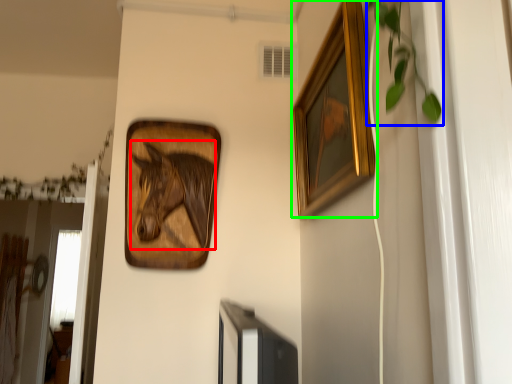
Question: Estimate the real-world distances between objects in this image. Which object is closer to animal (highlighted by a red box), plant (highlighted by a blue box) or picture frame (highlighted by a green box)?

Choices:
 (A) plant
 (B) picture frame

Answer: (B)